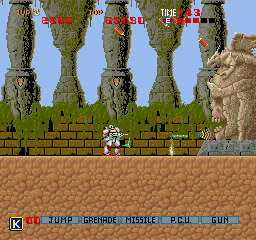
Identify the location of statue. The image size is (256, 240). (239, 104).